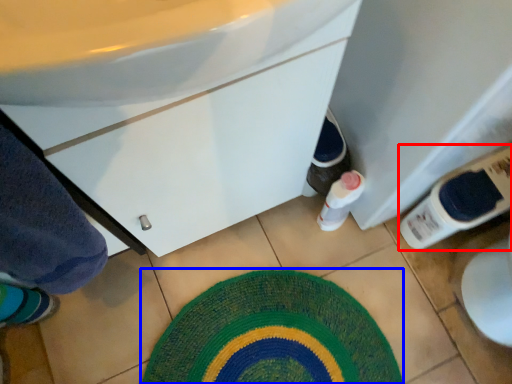
Question: Which point is further to the camera, bottle (highlighted by a red box) or bath mat (highlighted by a blue box)?

Choices:
 (A) bottle
 (B) bath mat

Answer: (B)